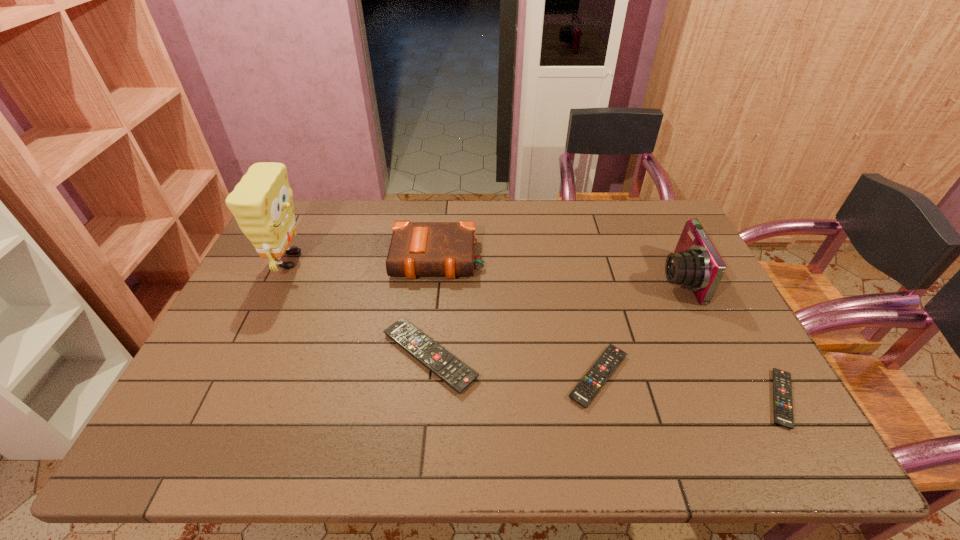
You are a GUI agent. You are given a task and a screenshot of the screen. Output one action in this format:
    pyautogui.click(x=<x>, y=<y>)
    Task: Click on the free location at the far right corner of the desktop
    
    Given the screenshot: What is the action you would take?
    pyautogui.click(x=626, y=201)

Where is `free spot between the rightmost remote control and the second remote control from right to left`? free spot between the rightmost remote control and the second remote control from right to left is located at coordinates (689, 388).

Where is `empty space that is in between the camera and the leftmost object`? The image size is (960, 540). empty space that is in between the camera and the leftmost object is located at coordinates (484, 269).

Find the location of a particular element. The height and width of the screenshot is (540, 960). vacant region between the shortest object and the sponge is located at coordinates (536, 329).

At what (x,y) coordinates should I click in order to perform the action: click on vacant space in between the fourth tallest object and the fourth object from left to right. Please return your answer as a coordinate pair (x, y). Looking at the image, I should click on click(x=514, y=366).

Where is `free spot between the shortest remote control and the Bible`? This screenshot has width=960, height=540. free spot between the shortest remote control and the Bible is located at coordinates (610, 329).

Identify the location of vacant area between the third tallest object and the rightmost remote control. The width and height of the screenshot is (960, 540). (610, 329).

This screenshot has width=960, height=540. I want to click on vacant area between the third tallest object and the camera, so click(x=558, y=268).

Image resolution: width=960 pixels, height=540 pixels. Identify the location of free space between the third shortest object and the fourth object from left to right. (514, 366).

The width and height of the screenshot is (960, 540). What are the coordinates of `vacant area that lies between the shortest object and the camera` in the screenshot? It's located at (730, 339).